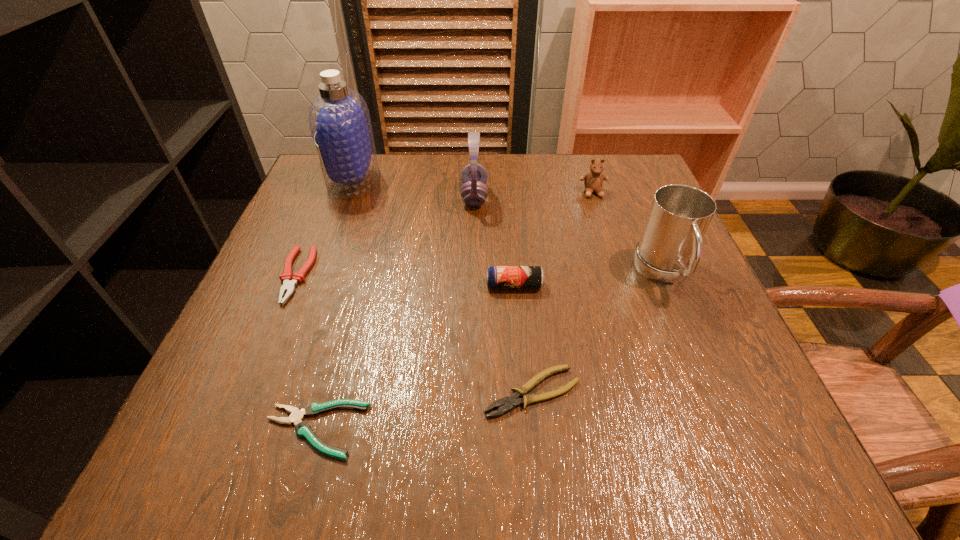
You are a GUI agent. You are given a task and a screenshot of the screen. Output one action in this format:
    pyautogui.click(x=<x>, y=<y>)
    Task: Click on the shortest object
    The height and width of the screenshot is (540, 960).
    Given the screenshot: What is the action you would take?
    pyautogui.click(x=303, y=429)

In order to click on the shortest pliers in this screenshot , I will do `click(303, 429)`.

The image size is (960, 540). What are the coordinates of `vacant space located on the front of the cleansing agent` in the screenshot? It's located at (319, 278).

Identify the location of vacant space situated 0.240m on the headband and ear cups of the headset. This screenshot has height=540, width=960. (588, 196).

Identify the location of free space located 0.250m on the side of the rightmost object with the handle. (732, 432).

Locate an element on the screen. Image resolution: width=960 pixels, height=540 pixels. free space located 0.400m on the front-facing side of the teddy bear is located at coordinates (636, 332).

Where is `blank space located 0.240m on the front of the beer can`? The width and height of the screenshot is (960, 540). blank space located 0.240m on the front of the beer can is located at coordinates (524, 409).

This screenshot has height=540, width=960. In order to click on free space located 0.260m on the back of the tallest pliers in this screenshot , I will do `click(336, 180)`.

Where is `free location located 0.120m on the right of the second tallest pliers`? The image size is (960, 540). free location located 0.120m on the right of the second tallest pliers is located at coordinates (657, 392).

Where is `vacant space located 0.140m on the back of the second pliers from left to right`? vacant space located 0.140m on the back of the second pliers from left to right is located at coordinates (344, 329).